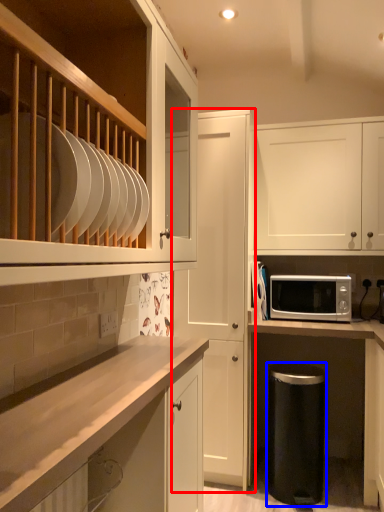
Question: Which object appears farthest to the camera in this image, cabinetry (highlighted by a red box) or dish washer (highlighted by a blue box)?

Choices:
 (A) cabinetry
 (B) dish washer

Answer: (A)